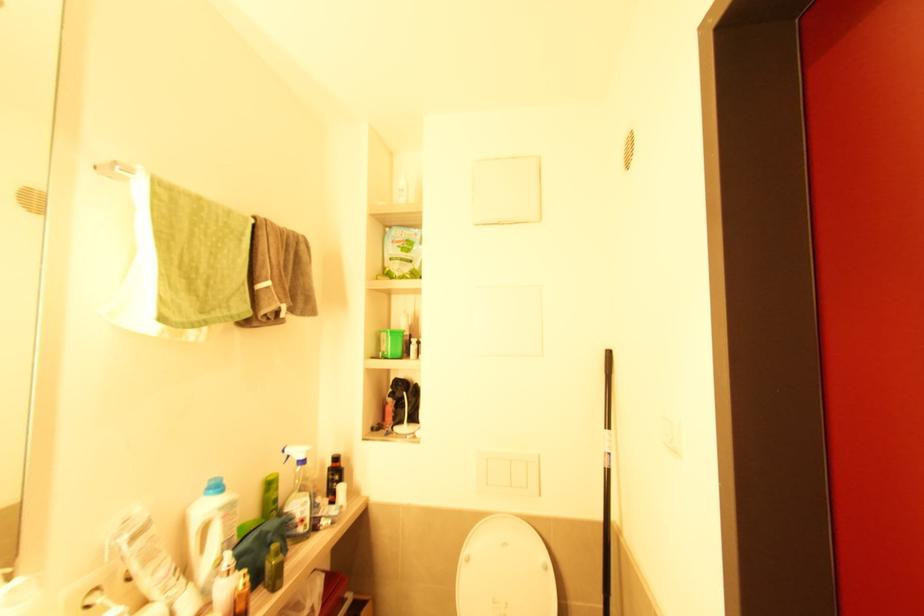
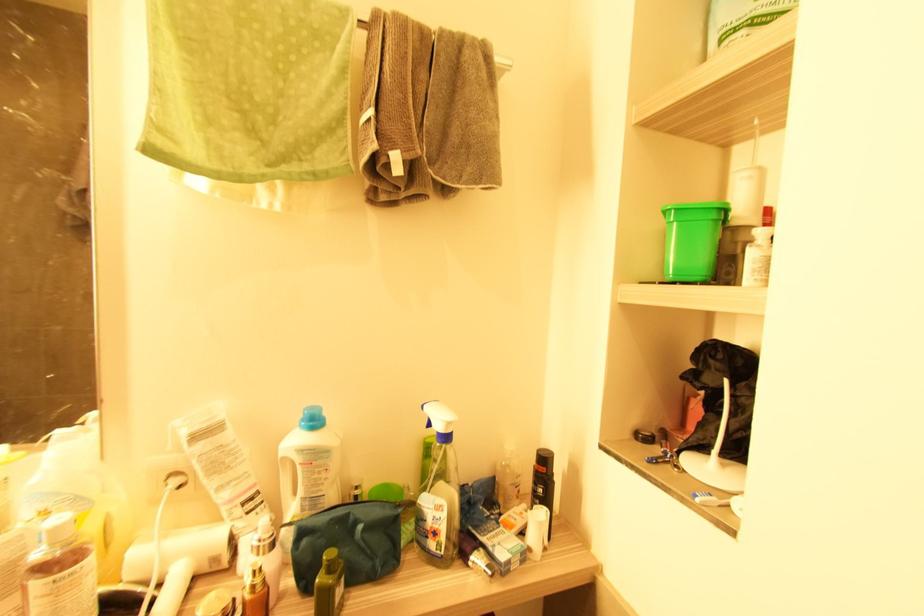
In the second image, find the point that corresponds to (x=231, y=570) in the first image.

(261, 546)